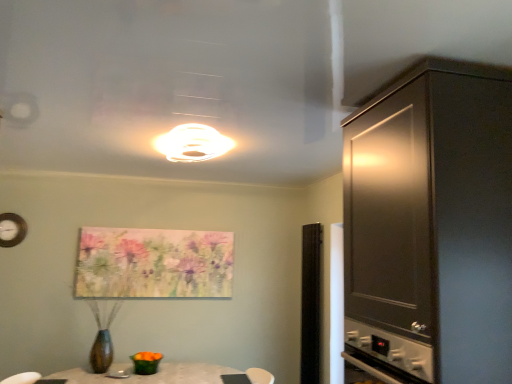
Question: Is transparent glass door at center placed right next to white glossy light fixture at upper center?

Choices:
 (A) yes
 (B) no

Answer: (B)

Question: From the image's perspective, is transparent glass door at center beneath white glossy light fixture at upper center?

Choices:
 (A) yes
 (B) no

Answer: (A)

Question: Is transparent glass door at center located outside white glossy light fixture at upper center?

Choices:
 (A) no
 (B) yes

Answer: (B)

Question: Is transparent glass door at center facing towards white glossy light fixture at upper center?

Choices:
 (A) yes
 (B) no

Answer: (B)

Question: Considering the relative positions of transparent glass door at center and white glossy light fixture at upper center in the image provided, is transparent glass door at center in front of white glossy light fixture at upper center?

Choices:
 (A) no
 (B) yes

Answer: (A)

Question: In terms of width, does dark wood cabinet at right look wider or thinner when compared to white glossy light fixture at upper center?

Choices:
 (A) thin
 (B) wide

Answer: (B)

Question: Looking at the image, does dark wood cabinet at right seem bigger or smaller compared to white glossy light fixture at upper center?

Choices:
 (A) big
 (B) small

Answer: (A)

Question: From a real-world perspective, is dark wood cabinet at right positioned above or below white glossy light fixture at upper center?

Choices:
 (A) below
 (B) above

Answer: (A)

Question: Is dark wood cabinet at right to the left or to the right of white glossy light fixture at upper center in the image?

Choices:
 (A) right
 (B) left

Answer: (A)

Question: Which is correct: dark wood cabinet at right is inside pastel floral canvas at center, or outside of it?

Choices:
 (A) inside
 (B) outside

Answer: (B)

Question: Is dark wood cabinet at right taller or shorter than pastel floral canvas at center?

Choices:
 (A) short
 (B) tall

Answer: (B)

Question: From a real-world perspective, is dark wood cabinet at right physically located above or below pastel floral canvas at center?

Choices:
 (A) below
 (B) above

Answer: (B)

Question: Is dark wood cabinet at right to the left or to the right of pastel floral canvas at center in the image?

Choices:
 (A) left
 (B) right

Answer: (B)

Question: In terms of height, does pastel floral canvas at center look taller or shorter compared to white glossy light fixture at upper center?

Choices:
 (A) short
 (B) tall

Answer: (B)

Question: Would you say pastel floral canvas at center is to the left or to the right of white glossy light fixture at upper center in the picture?

Choices:
 (A) right
 (B) left

Answer: (B)